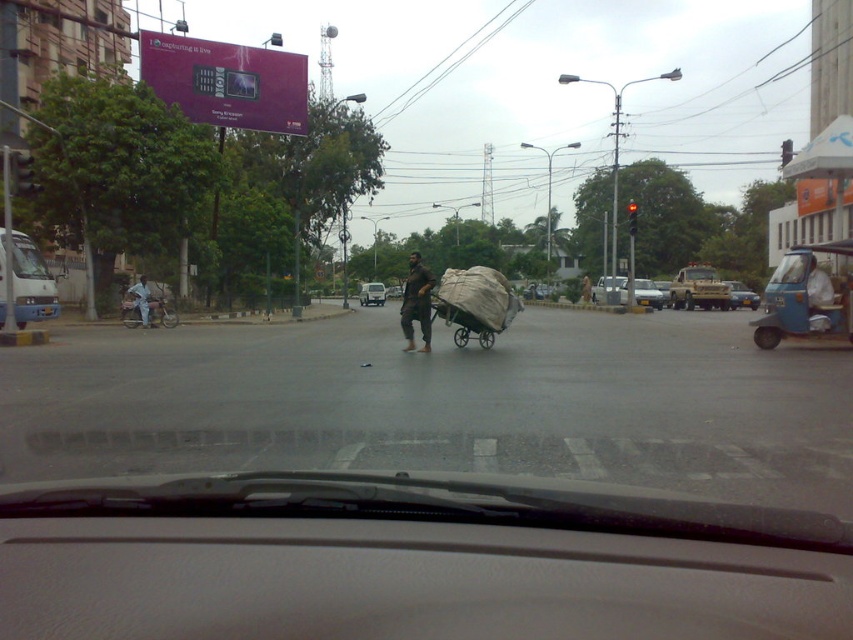
You are a delivery driver who needs to park your matte blue truck at left and silver metallic sedan at center in a parking lot that can only accommodate one vehicle at a time. Which vehicle should you park first to ensure both can fit?

The matte blue truck at left has a smaller size compared to the silver metallic sedan at center, so you should park the matte blue truck at left first. This allows the larger silver metallic sedan at center to fit into the remaining space.

You are a passenger in the car and notice the green fabric cart at center and the dark brown fabric at center outside. Which object is closer to the car?

The green fabric cart at center is closer to the car because it is positioned below the dark brown fabric at center, indicating it is nearer in the visual plane.

You are a delivery driver who needs to know if the dark brown fabric at center can fit through a narrow alley that the metallic silver truck at center can pass through. Can it?

The dark brown fabric at center is much taller than the metallic silver truck at center, so it cannot fit through the alley that the truck can pass through.